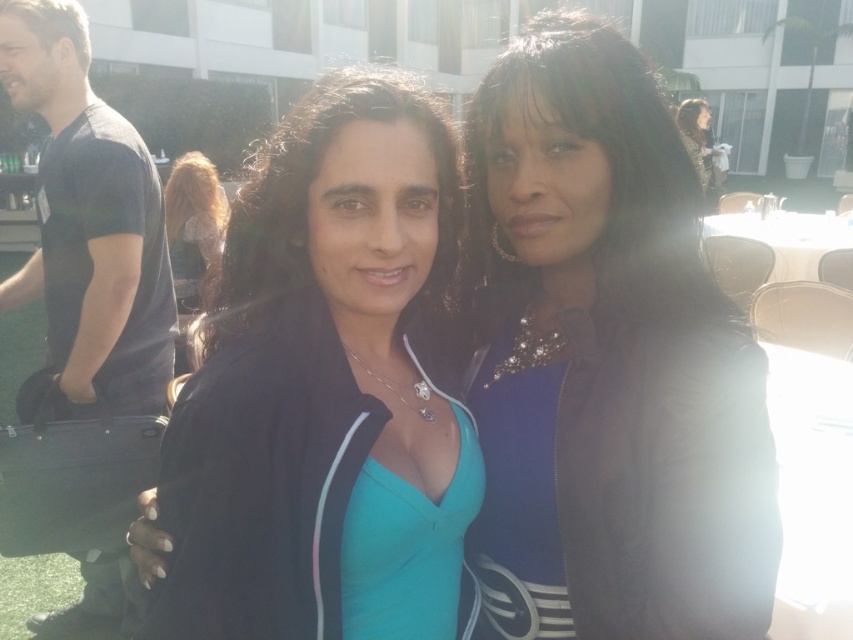
Is satin black jacket at center behind dark brown hair at center?

No, satin black jacket at center is closer to the viewer.

Does satin black jacket at center appear over dark brown hair at center?

Actually, satin black jacket at center is below dark brown hair at center.

The height and width of the screenshot is (640, 853). Identify the location of satin black jacket at center. (608, 362).

Between matte black jacket at center and dark brown hair at center, which one is positioned lower?

matte black jacket at center is below.

Does point (422, 132) lie behind point (218, 305)?

No.

Image resolution: width=853 pixels, height=640 pixels. What do you see at coordinates (321, 378) in the screenshot? I see `matte black jacket at center` at bounding box center [321, 378].

Locate an element on the screen. The width and height of the screenshot is (853, 640). matte black jacket at center is located at coordinates (321, 378).

Can you confirm if blonde hair at upper left is smaller than shiny black jacket at upper right?

No, blonde hair at upper left is not smaller than shiny black jacket at upper right.

Does blonde hair at upper left have a lesser width compared to shiny black jacket at upper right?

No, blonde hair at upper left is not thinner than shiny black jacket at upper right.

Is point (173, 182) positioned before point (694, 138)?

Yes, it is.

Identify the location of blonde hair at upper left. Image resolution: width=853 pixels, height=640 pixels. (193, 227).